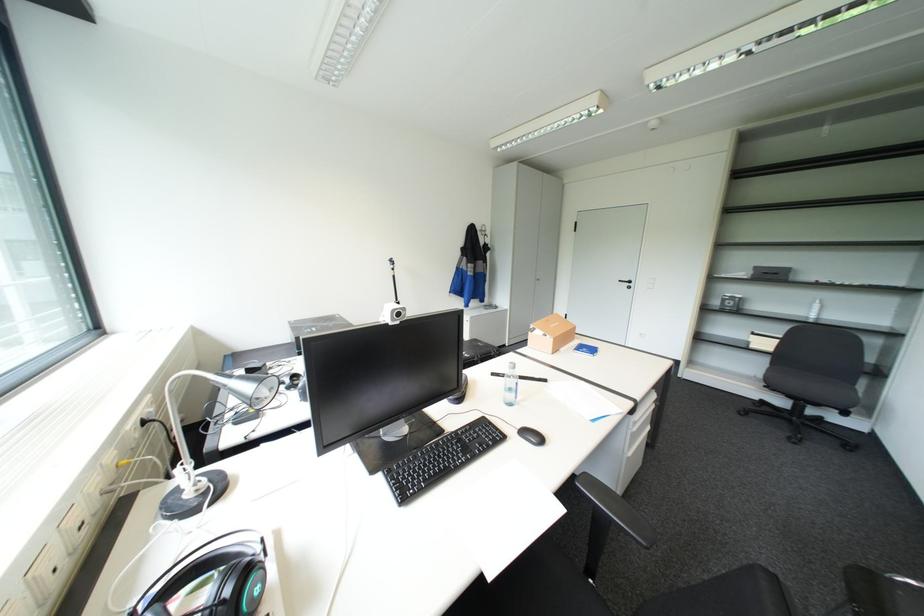
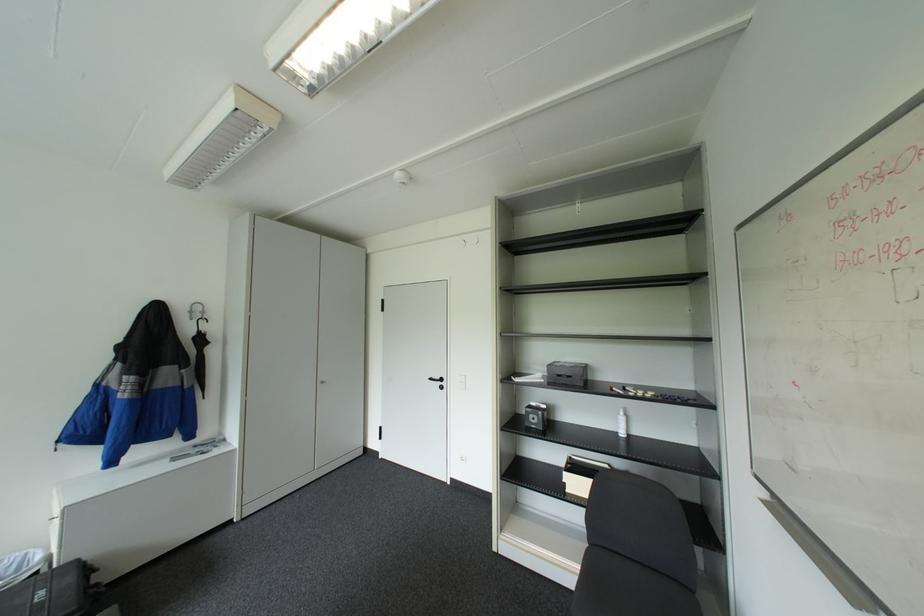
In the second image, find the point that corresponds to point 755,276 in the first image.

(551, 379)